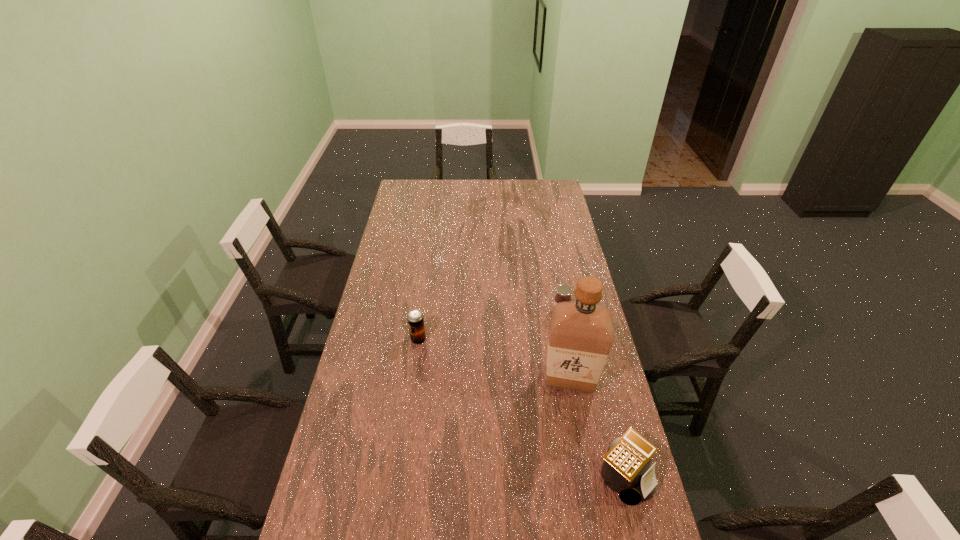
The image size is (960, 540). In order to click on vacant space located 0.130m on the label side of the jam in this screenshot , I will do `click(549, 341)`.

Locate an element on the screen. This screenshot has height=540, width=960. free space located 0.060m on the front-facing side of the third farthest object is located at coordinates (541, 403).

You are a GUI agent. You are given a task and a screenshot of the screen. Output one action in this format:
    pyautogui.click(x=<x>, y=<y>)
    Task: Click on the vacant region located on the front-facing side of the third farthest object
    
    Given the screenshot: What is the action you would take?
    pyautogui.click(x=479, y=467)

At what (x,y) coordinates should I click in order to perform the action: click on vacant space located on the front-facing side of the third farthest object. Please return your answer as a coordinate pair (x, y). Looking at the image, I should click on (499, 446).

Locate an element on the screen. calculator that is at the right edge is located at coordinates 625,470.

This screenshot has width=960, height=540. Identify the location of jam that is at the right edge. (564, 291).

At what (x,y) coordinates should I click in order to perform the action: click on liquor that is at the right edge. Please return your answer as a coordinate pair (x, y). Looking at the image, I should click on (581, 333).

In the image, there is a desktop. Identify the location of vacant area at the far edge. The image size is (960, 540). (457, 199).

In the image, there is a desktop. Identify the location of vacant space at the left edge. The height and width of the screenshot is (540, 960). (372, 477).

Locate an element on the screen. The width and height of the screenshot is (960, 540). free spot at the right edge of the desktop is located at coordinates (x=558, y=259).